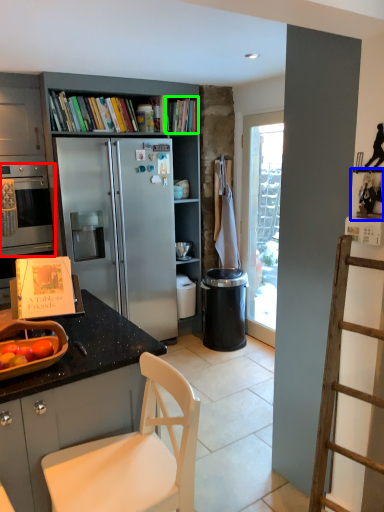
Question: Considering the real-world distances, which object is farthest from oven (highlighted by a red box)? shelf (highlighted by a blue box) or book (highlighted by a green box)?

Choices:
 (A) shelf
 (B) book

Answer: (A)